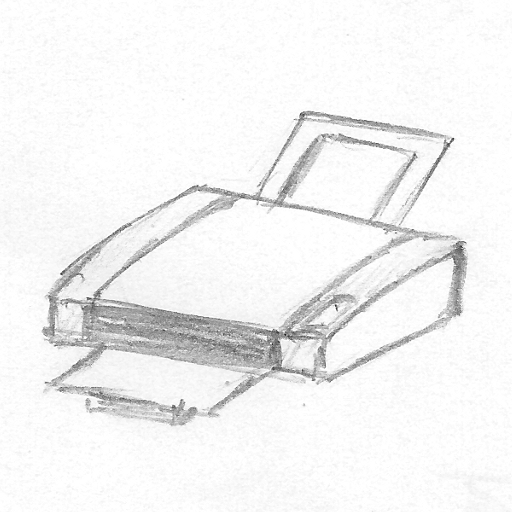
Where is `side of printer`? The height and width of the screenshot is (512, 512). side of printer is located at coordinates (380, 332).